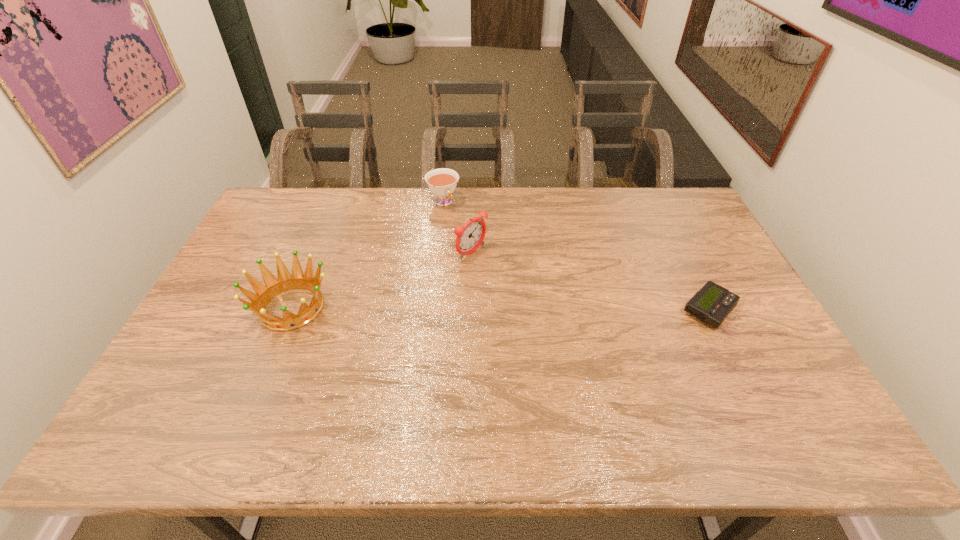
The height and width of the screenshot is (540, 960). I want to click on vacant space located on the front-facing side of the tallest object, so click(x=544, y=299).

At what (x,y) coordinates should I click in order to perform the action: click on free point located on the side of the teacup with the handle. Please return your answer as a coordinate pair (x, y). The image size is (960, 540). Looking at the image, I should click on (454, 220).

Identify the location of vacant area located on the side of the teacup with the handle. Image resolution: width=960 pixels, height=540 pixels. (463, 233).

Find the location of a particular element. The width and height of the screenshot is (960, 540). free space located on the side of the teacup with the handle is located at coordinates (461, 231).

At what (x,y) coordinates should I click in order to perform the action: click on object that is at the far edge. Please return your answer as a coordinate pair (x, y). The width and height of the screenshot is (960, 540). Looking at the image, I should click on (442, 182).

Find the location of a particular element. The height and width of the screenshot is (540, 960). object located in the left edge section of the desktop is located at coordinates point(263,295).

This screenshot has height=540, width=960. In order to click on object that is at the right edge in this screenshot , I will do `click(713, 303)`.

I want to click on vacant point at the far edge, so click(377, 224).

Locate an element on the screen. The width and height of the screenshot is (960, 540). free spot at the left edge of the desktop is located at coordinates (221, 297).

Where is `free spot at the right edge of the desktop`? This screenshot has width=960, height=540. free spot at the right edge of the desktop is located at coordinates (665, 229).